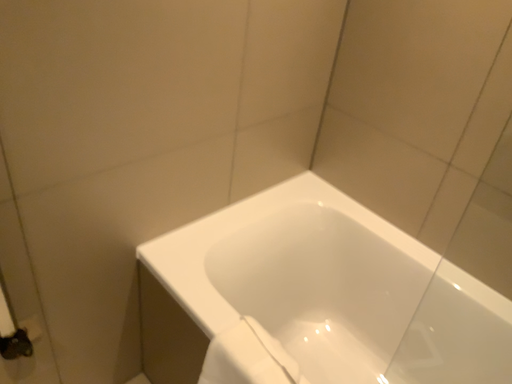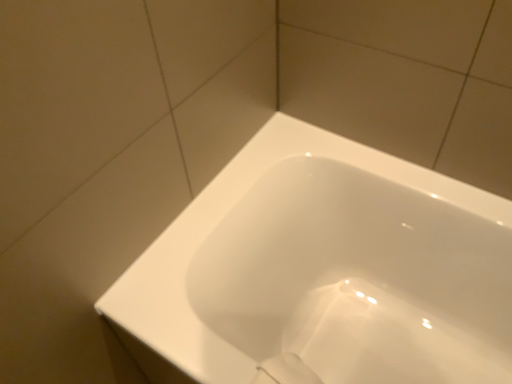
Question: Which way did the camera rotate in the video?

Choices:
 (A) rotated upward
 (B) rotated downward

Answer: (B)